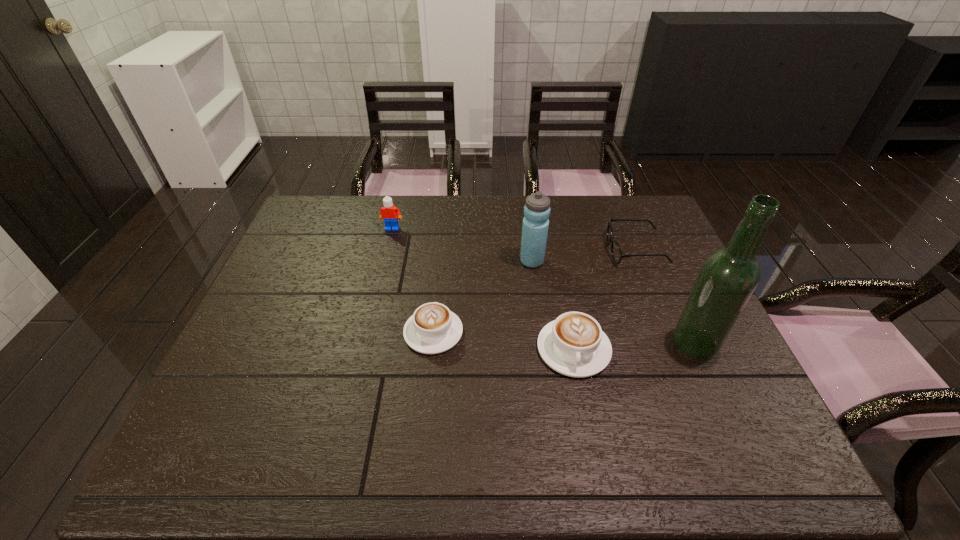
I want to click on spectacles that is at the right edge, so [616, 252].

What are the coordinates of `liquor present at the right edge` in the screenshot? It's located at (728, 277).

Where is `object at the far right corner`? Image resolution: width=960 pixels, height=540 pixels. object at the far right corner is located at coordinates (616, 252).

This screenshot has width=960, height=540. In order to click on vacant space at the far edge of the desktop in this screenshot , I will do `click(365, 202)`.

Find the location of a particular element. free space at the near edge of the desktop is located at coordinates (686, 420).

Locate an element on the screen. The width and height of the screenshot is (960, 540). blank space at the left edge is located at coordinates (298, 248).

This screenshot has width=960, height=540. I want to click on vacant space at the right edge, so click(x=663, y=249).

This screenshot has width=960, height=540. I want to click on vacant space at the far left corner of the desktop, so click(x=326, y=235).

Find the location of a particular element. vacant region at the near right corner of the desktop is located at coordinates (691, 394).

This screenshot has width=960, height=540. Find the location of `free space between the leftmost object and the left cappuccino`. free space between the leftmost object and the left cappuccino is located at coordinates pos(413,280).